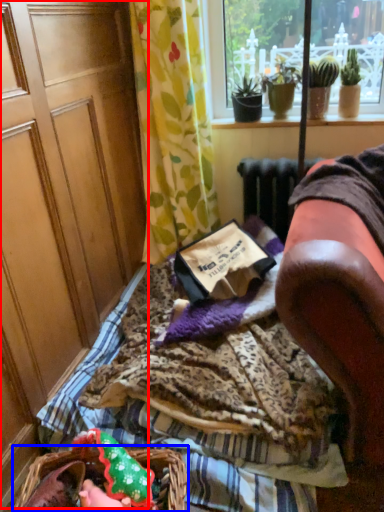
Question: Among these objects, which one is nearest to the camera, screen door (highlighted by a red box) or flower basket (highlighted by a blue box)?

Choices:
 (A) screen door
 (B) flower basket

Answer: (A)